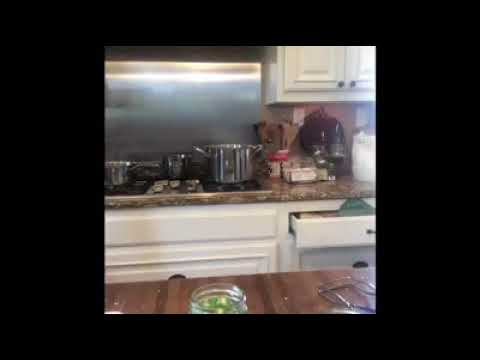
I want to click on stove, so click(134, 192).